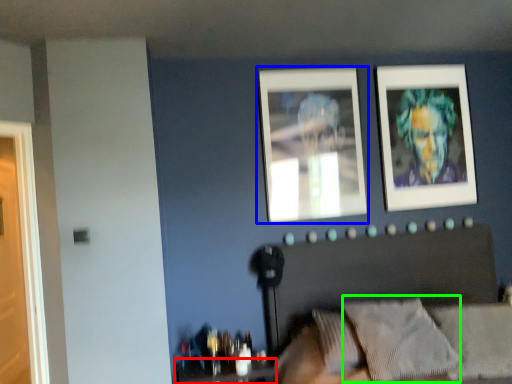
Question: Considering the real-world distances, which object is farthest from table (highlighted by a red box)? picture frame (highlighted by a blue box) or pillow (highlighted by a green box)?

Choices:
 (A) picture frame
 (B) pillow

Answer: (A)